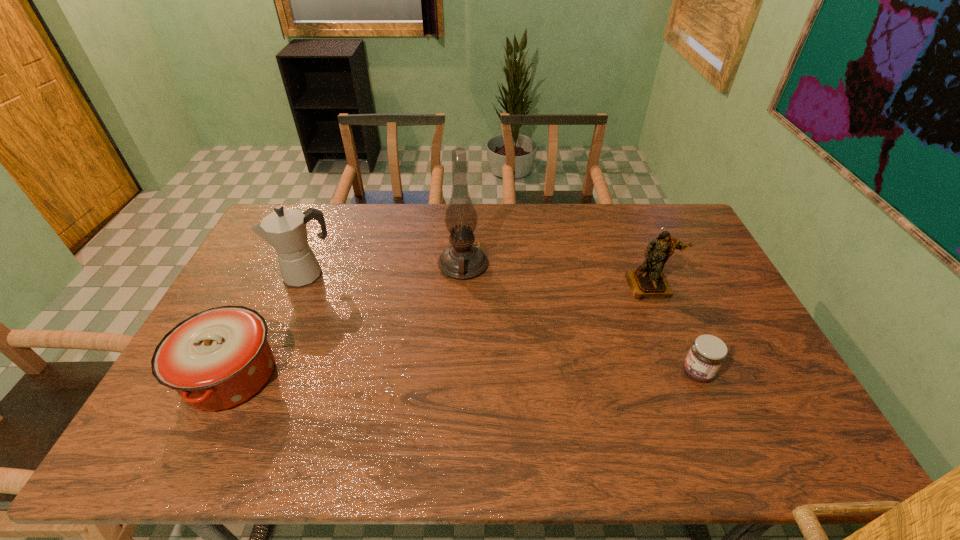
Image resolution: width=960 pixels, height=540 pixels. What are the coordinates of `free space at the right edge of the desktop` in the screenshot? It's located at (698, 273).

Where is `vacant space at the far left corner`? vacant space at the far left corner is located at coordinates tap(296, 206).

At what (x,y) coordinates should I click in order to perform the action: click on free space between the figurine and the coffeepot. Please return your answer as a coordinate pair (x, y). Looking at the image, I should click on (478, 280).

Find the location of a particular element. The image size is (960, 540). free point between the shortest object and the figurine is located at coordinates (674, 329).

At what (x,y) coordinates should I click in order to perform the action: click on free space between the casserole and the coffeepot. Please return your answer as a coordinate pair (x, y). This screenshot has height=540, width=960. Looking at the image, I should click on (269, 325).

The height and width of the screenshot is (540, 960). Find the location of `free space that is in between the jam and the casserole`. free space that is in between the jam and the casserole is located at coordinates pos(464,374).

The width and height of the screenshot is (960, 540). Find the location of `vacant point located between the coffeepot and the third object from left to right`. vacant point located between the coffeepot and the third object from left to right is located at coordinates (384, 270).

Locate an element on the screen. free space between the third object from left to right and the figurine is located at coordinates [557, 275].

Locate an element on the screen. The width and height of the screenshot is (960, 540). free spot between the figurine and the coffeepot is located at coordinates (478, 280).

Find the location of a particular element. The width and height of the screenshot is (960, 540). unoccupied area between the coffeepot and the casserole is located at coordinates (269, 325).